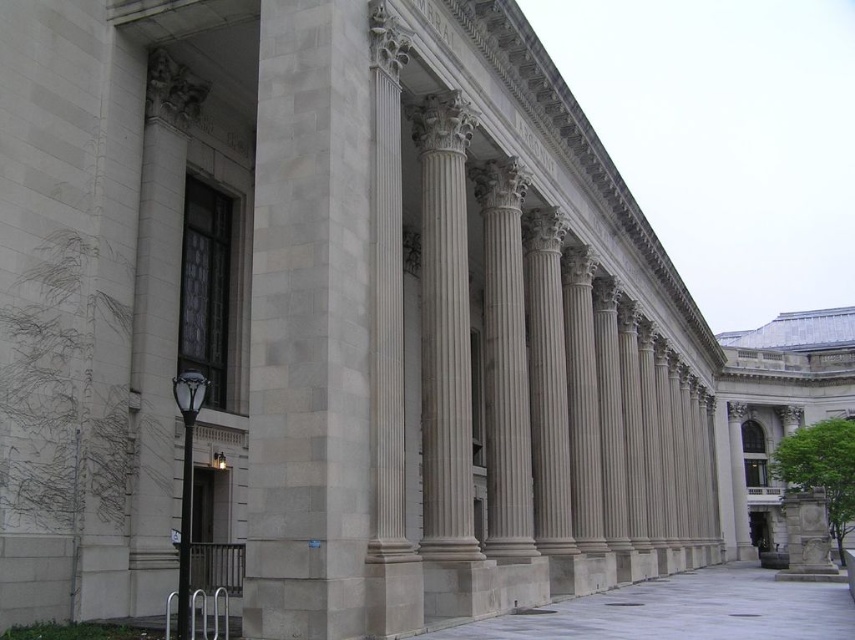
Question: Can you confirm if white marble column at center is wider than gray concrete pavement at center?

Choices:
 (A) yes
 (B) no

Answer: (B)

Question: Which point is closer to the camera?

Choices:
 (A) (824, 586)
 (B) (276, 468)

Answer: (B)

Question: Is white marble column at center positioned at the back of gray concrete pavement at center?

Choices:
 (A) no
 (B) yes

Answer: (A)

Question: Can you confirm if white marble column at center is positioned above gray concrete pavement at center?

Choices:
 (A) yes
 (B) no

Answer: (A)